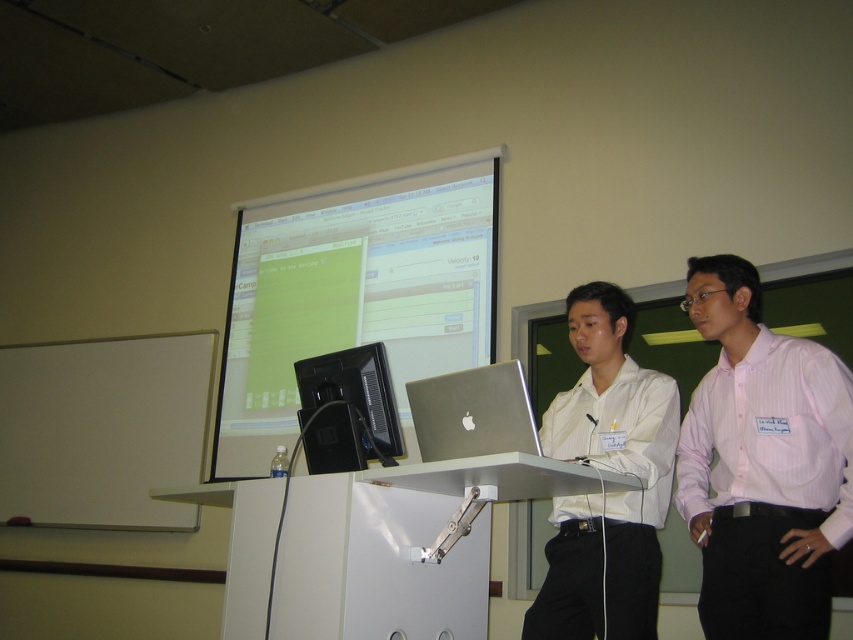
You are a student sitting in the classroom and want to see both the matte white projection screen at upper center and the person wearing the pink striped shirt at center right. Can you see both at the same time without moving your head?

The pink striped shirt at center right is behind the matte white projection screen at upper center, so the person wearing it might be obscured by the screen. You might not be able to see both clearly at the same time without moving your head.

You are a student in the classroom and need to walk from the front of the room to the back. There is a matte white projection screen at upper center and a pink striped shirt at center right in your path. How far apart are these two objects?

The distance between the matte white projection screen at upper center and the pink striped shirt at center right is 1.72 meters.

You are a student sitting at the back of the classroom. You need to hand in a paper to the person wearing the pink striped shirt at center right. The black glossy monitor at center is blocking your view. Can you reach the person without moving the monitor?

The distance between the pink striped shirt at center right and the black glossy monitor at center is 3.54 feet. Since the monitor is blocking your view but there is space between them, you can reach the person by moving around the monitor as there is enough space between them.